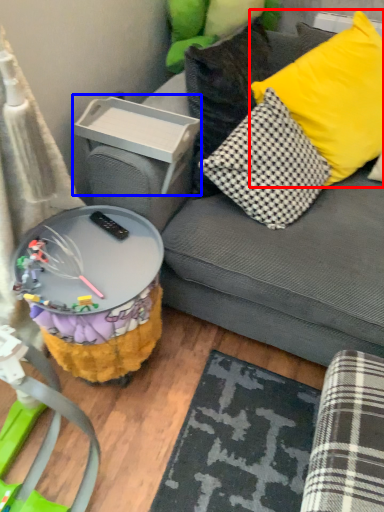
Question: Among these objects, which one is farthest to the camera, pillow (highlighted by a red box) or storage box (highlighted by a blue box)?

Choices:
 (A) pillow
 (B) storage box

Answer: (B)